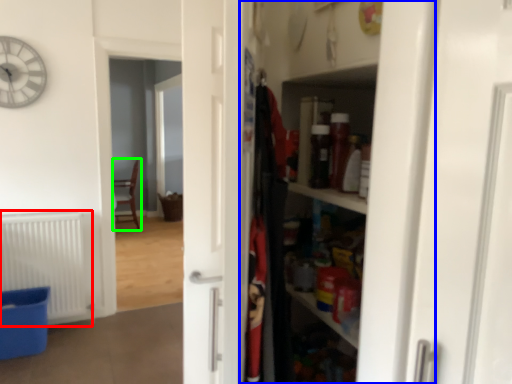
Question: Which object is positioned farthest from radiator (highlighted by a red box)? Select from dresser (highlighted by a blue box) and chair (highlighted by a green box).

Choices:
 (A) dresser
 (B) chair

Answer: (B)